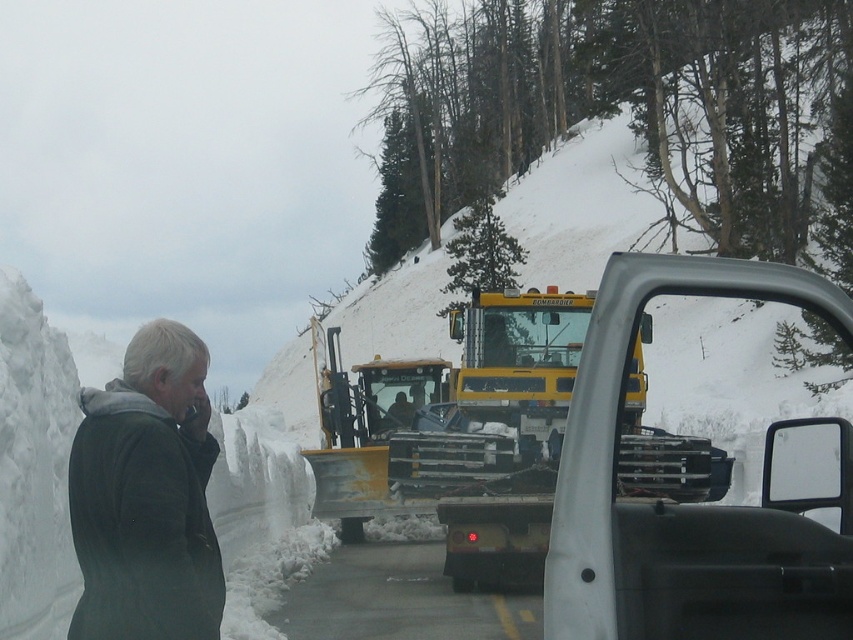
Is metallic silver trailer truck at center thinner than dark gray jacket at left?

Answer: Yes.

Between metallic silver trailer truck at center and dark gray jacket at left, which one appears on the right side from the viewer's perspective?

metallic silver trailer truck at center

Is point (604, 314) less distant than point (82, 508)?

That is True.

Where is `metallic silver trailer truck at center`? metallic silver trailer truck at center is located at coordinates (663, 504).